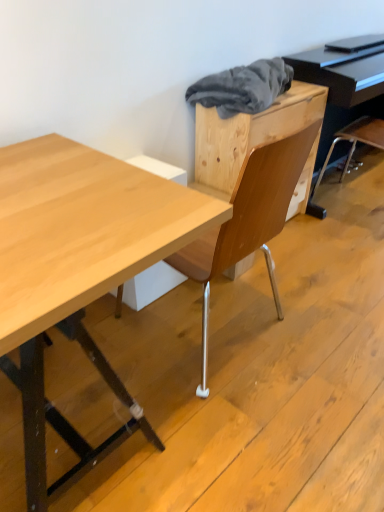
Where is `free spot in front of black glossy piano at upper right`? The height and width of the screenshot is (512, 384). free spot in front of black glossy piano at upper right is located at coordinates pyautogui.click(x=343, y=239).